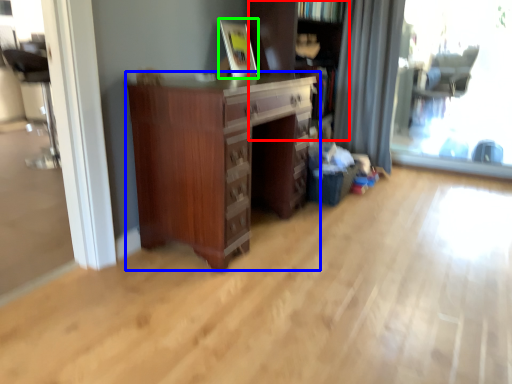
Question: Which object is positioned closest to bookcase (highlighted by a red box)? Select from chest of drawers (highlighted by a blue box) and picture frame (highlighted by a green box).

Choices:
 (A) chest of drawers
 (B) picture frame

Answer: (B)